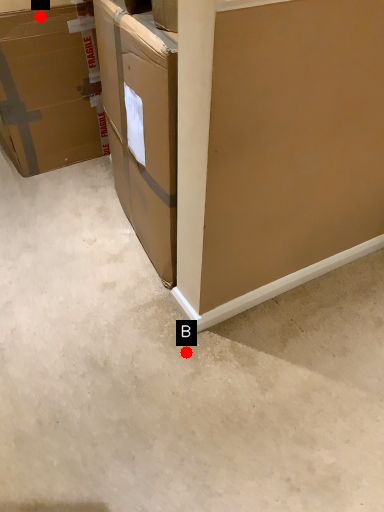
Question: Two points are circled on the image, labeled by A and B beside each circle. Which point appears farthest from the camera in this image?

Choices:
 (A) A is further
 (B) B is further

Answer: (A)